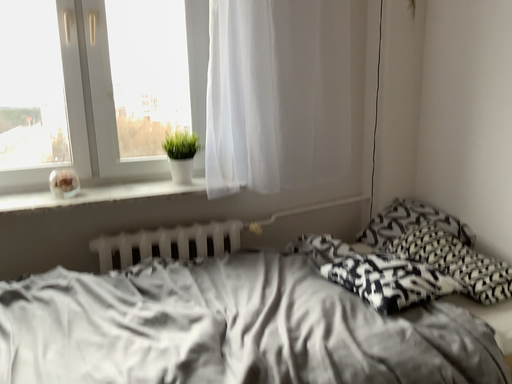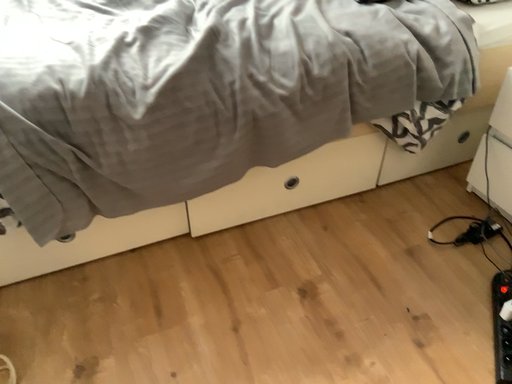
Question: How did the camera likely rotate when shooting the video?

Choices:
 (A) rotated upward
 (B) rotated downward

Answer: (B)